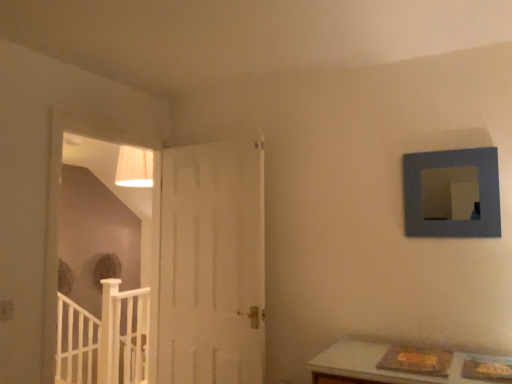
The width and height of the screenshot is (512, 384). I want to click on white wooden rail at lower left, so click(x=104, y=338).

In order to face white wooden rail at lower left, should I rotate leftwards or rightwards?

To face it directly, rotate left by 19.308 degrees.

Identify the location of blue matte picture frame at upper right. (450, 193).

Locate an element on the screen. white wooden rail at lower left is located at coordinates (104, 338).

Considering the sizes of objects white wooden rail at lower left and blue matte picture frame at upper right in the image provided, who is taller, white wooden rail at lower left or blue matte picture frame at upper right?

white wooden rail at lower left.

Is white wooden rail at lower left directly adjacent to blue matte picture frame at upper right?

white wooden rail at lower left is not next to blue matte picture frame at upper right, and they're not touching.

Is blue matte picture frame at upper right completely or partially inside white wooden rail at lower left?

No, blue matte picture frame at upper right is not surrounded by white wooden rail at lower left.

Can you see white wooden rail at lower left touching white wood door at left?

They are not placed beside each other.

Is point (111, 291) positioned behind point (42, 360)?

Yes, it is.

Between white wooden rail at lower left and white wood door at left, which one appears on the left side from the viewer's perspective?

From the viewer's perspective, white wooden rail at lower left appears more on the left side.

Considering the sizes of objects white wood door at left and white wooden rail at lower left in the image provided, who is wider, white wood door at left or white wooden rail at lower left?

Wider between the two is white wooden rail at lower left.

Is white wooden rail at lower left at the back of white wood door at left?

That's not correct — white wood door at left is not looking away from white wooden rail at lower left.

From a real-world perspective, does white wood door at left sit lower than white wooden rail at lower left?

No, from a real-world perspective, white wood door at left is not beneath white wooden rail at lower left.

Who is smaller, white wood door at left or white wooden rail at lower left?

Smaller between the two is white wood door at left.

From a real-world perspective, is blue matte picture frame at upper right beneath white wood door at left?

No, from a real-world perspective, blue matte picture frame at upper right is not under white wood door at left.

Is blue matte picture frame at upper right beside white wood door at left?

No, blue matte picture frame at upper right is not in contact with white wood door at left.

From the image's perspective, relative to white wood door at left, is blue matte picture frame at upper right above or below?

Clearly, from the image's perspective, blue matte picture frame at upper right is above white wood door at left.

Is blue matte picture frame at upper right inside or outside of white wood door at left?

The correct answer is: outside.

Is blue matte picture frame at upper right far from white wooden rail at lower left?

blue matte picture frame at upper right is far away from white wooden rail at lower left.

Considering the positions of points (410, 231) and (92, 343), is point (410, 231) farther from camera compared to point (92, 343)?

No, it is not.

Where is `picture frame located in front of the white wooden rail at lower left`? The height and width of the screenshot is (384, 512). picture frame located in front of the white wooden rail at lower left is located at coordinates (450, 193).

Considering the relative positions of white wood door at left and blue matte picture frame at upper right in the image provided, is white wood door at left to the right of blue matte picture frame at upper right from the viewer's perspective?

In fact, white wood door at left is to the left of blue matte picture frame at upper right.

Is white wood door at left closer to the viewer compared to blue matte picture frame at upper right?

No, white wood door at left is further to the viewer.

From a real-world perspective, which is physically below, white wood door at left or blue matte picture frame at upper right?

In real-world perspective, white wood door at left is lower.

Is white wood door at left turned away from blue matte picture frame at upper right?

No, white wood door at left's orientation is not away from blue matte picture frame at upper right.

The height and width of the screenshot is (384, 512). I want to click on picture frame in front of the white wooden rail at lower left, so click(x=450, y=193).

You are a GUI agent. You are given a task and a screenshot of the screen. Output one action in this format:
    pyautogui.click(x=<x>, y=<y>)
    Task: Click on the window frame lying on the right of white wooden rail at lower left
    The height and width of the screenshot is (384, 512).
    Given the screenshot: What is the action you would take?
    pyautogui.click(x=56, y=232)

Considering their positions, is white wood door at left positioned further to blue matte picture frame at upper right than white wooden rail at lower left?

white wooden rail at lower left is positioned further to the anchor blue matte picture frame at upper right.

When comparing their distances from white wooden rail at lower left, does white wood door at left or blue matte picture frame at upper right seem closer?

white wood door at left lies closer to white wooden rail at lower left than the other object.

Based on their spatial positions, is white wooden rail at lower left or blue matte picture frame at upper right closer to white wood door at left?

white wooden rail at lower left is closer to white wood door at left.

Based on their spatial positions, is blue matte picture frame at upper right or white wood door at left further from white wooden rail at lower left?

Among the two, blue matte picture frame at upper right is located further to white wooden rail at lower left.

Looking at the image, which one is located closer to blue matte picture frame at upper right, white wooden rail at lower left or white wood door at left?

white wood door at left.

Considering their positions, is blue matte picture frame at upper right positioned further to white wood door at left than white wooden rail at lower left?

Among the two, blue matte picture frame at upper right is located further to white wood door at left.

Where is `window frame between white wooden rail at lower left and blue matte picture frame at upper right from left to right`? The width and height of the screenshot is (512, 384). window frame between white wooden rail at lower left and blue matte picture frame at upper right from left to right is located at coordinates (56, 232).